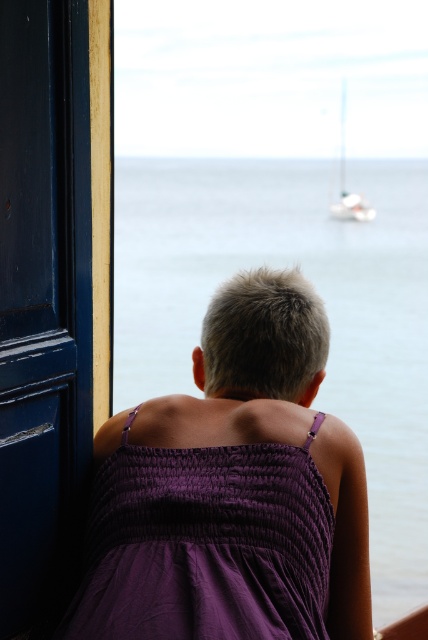
Can you confirm if purple satin dress at center is positioned below white glossy sailboat at upper right?

Correct, purple satin dress at center is located below white glossy sailboat at upper right.

Who is more distant from viewer, (x=250, y=458) or (x=341, y=124)?

Point (x=341, y=124)

Who is more forward, (201, 420) or (342, 205)?

Positioned in front is point (201, 420).

The image size is (428, 640). In order to click on purple satin dress at center in this screenshot , I will do `click(231, 490)`.